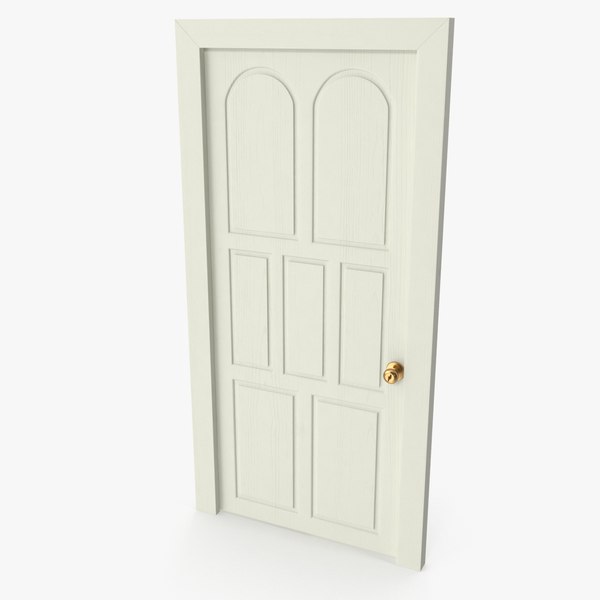
What are the coordinates of `right edge of door` in the screenshot? It's located at (432, 368).